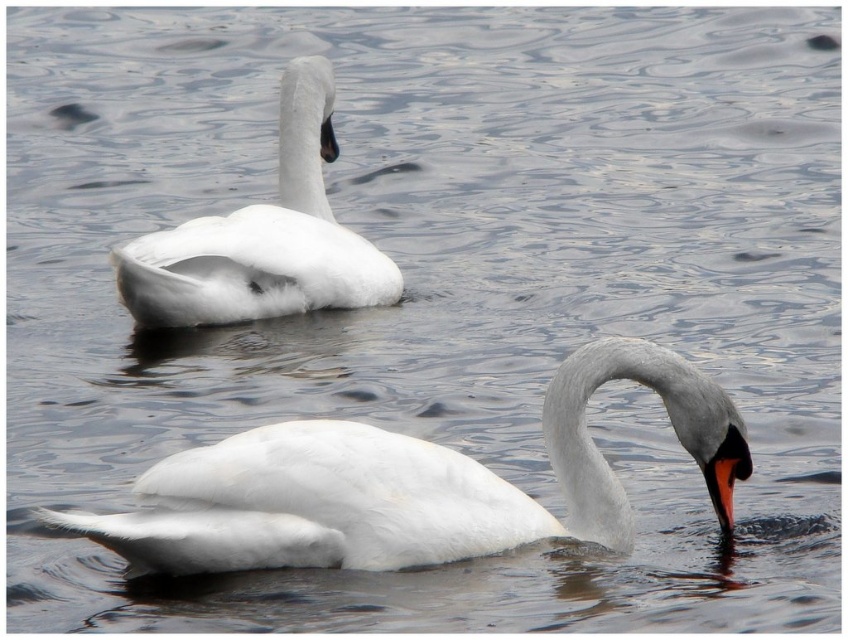
You are a photographer trying to capture both the white glossy swan at lower center and the white matte swan at upper left in a single frame. Based on their positions, which swan is located to the right of the other?

The white glossy swan at lower center is positioned on the right side of the white matte swan at upper left.

You are standing on the shore of the lake and want to take a photo of both the white glossy swan at lower center and the white matte swan at upper left. Which swan will appear closer to the camera in your photo?

The white glossy swan at lower center will appear closer to the camera in the photo because it is positioned under the white matte swan at upper left, indicating it is nearer to the observer.

You are standing on the edge of the water and see the white glossy swan at lower center. If you want to throw a small pebble to land exactly where the swan is currently located, which direction should you aim relative to your position?

The white glossy swan at lower center is located at point (x=409, y=483), so you should aim slightly to the right and forward from your position to hit the exact coordinates where the swan is currently positioned.